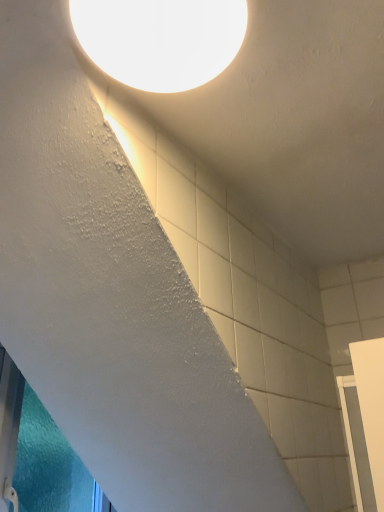
What is the approximate width of transparent frosted glass at lower left?

transparent frosted glass at lower left is 12.10 centimeters wide.

At what (x,y) coordinates should I click in order to perform the action: click on transparent frosted glass at lower left. Please return your answer as a coordinate pair (x, y). This screenshot has height=512, width=384. Looking at the image, I should click on (38, 455).

In order to face transparent frosted glass at lower left, should I rotate leftwards or rightwards?

You should look left and rotate roughly 17.516 degrees.

Describe the element at coordinates (38, 455) in the screenshot. I see `transparent frosted glass at lower left` at that location.

At what (x,y) coordinates should I click in order to perform the action: click on transparent frosted glass at lower left. Please return your answer as a coordinate pair (x, y). Image resolution: width=384 pixels, height=512 pixels. Looking at the image, I should click on (38, 455).